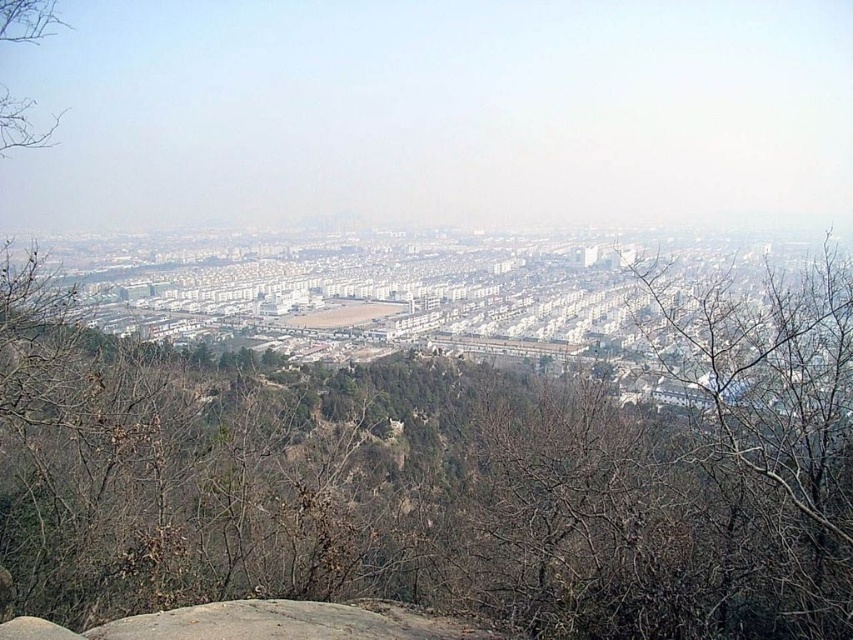
Image resolution: width=853 pixels, height=640 pixels. What do you see at coordinates (444, 477) in the screenshot?
I see `brown leafless tree at center` at bounding box center [444, 477].

Between brown leafless tree at center and gray rough rock at center, which one has more height?

With more height is brown leafless tree at center.

Is point (834, 625) positioned in front of point (502, 637)?

Yes, it is in front of point (502, 637).

Find the location of a particular element. The height and width of the screenshot is (640, 853). brown leafless tree at center is located at coordinates (444, 477).